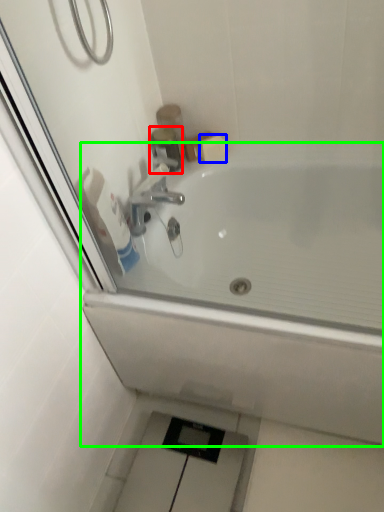
Question: Based on their relative distances, which object is farther from plumbing fixture (highlighted by a red box)? Choose from soap (highlighted by a blue box) and bathtub (highlighted by a green box).

Choices:
 (A) soap
 (B) bathtub

Answer: (B)